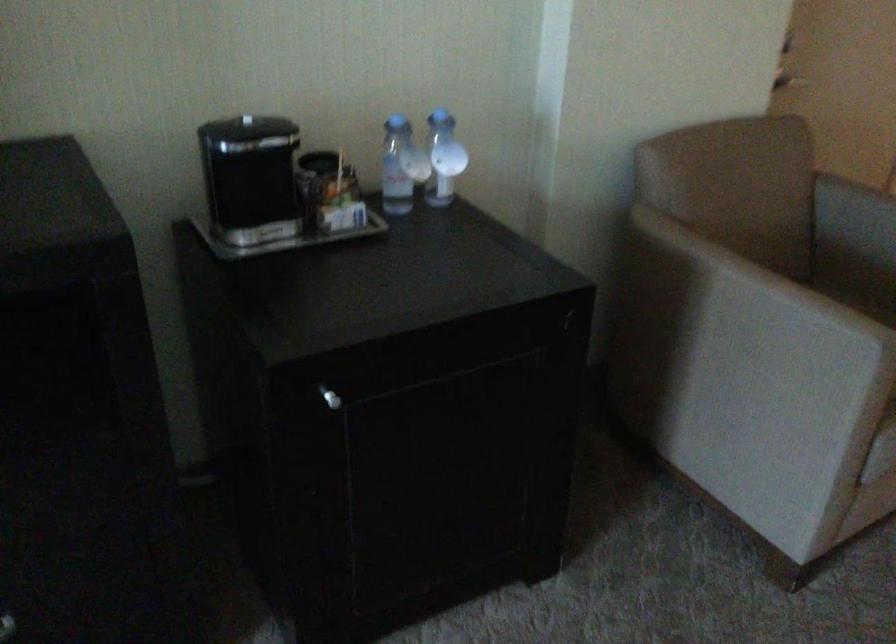
The width and height of the screenshot is (896, 644). I want to click on chair armrest, so click(x=739, y=319).